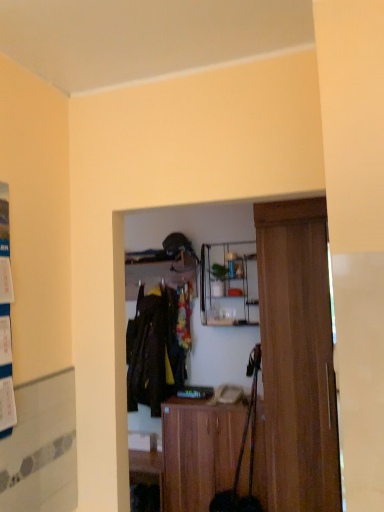
Question: Would you say wooden door at right is outside white paper poster at left?

Choices:
 (A) yes
 (B) no

Answer: (A)

Question: From the image's perspective, does wooden door at right appear higher than white paper poster at left?

Choices:
 (A) no
 (B) yes

Answer: (A)

Question: Can you confirm if wooden door at right is shorter than white paper poster at left?

Choices:
 (A) no
 (B) yes

Answer: (A)

Question: Does wooden door at right have a smaller size compared to white paper poster at left?

Choices:
 (A) no
 (B) yes

Answer: (A)

Question: Would you say wooden door at right contains white paper poster at left?

Choices:
 (A) yes
 (B) no

Answer: (B)

Question: Is wooden door at right thinner than white paper poster at left?

Choices:
 (A) yes
 (B) no

Answer: (B)

Question: From a real-world perspective, is wooden shelf at center, the 2th shelf in the right-to-left sequence, located beneath wooden door at right?

Choices:
 (A) no
 (B) yes

Answer: (A)

Question: Considering the relative sizes of wooden shelf at center, the 2th shelf in the right-to-left sequence, and wooden door at right in the image provided, is wooden shelf at center, the 2th shelf in the right-to-left sequence, shorter than wooden door at right?

Choices:
 (A) no
 (B) yes

Answer: (B)

Question: Can we say wooden shelf at center, the 2th shelf in the right-to-left sequence, lies outside wooden door at right?

Choices:
 (A) no
 (B) yes

Answer: (B)

Question: From a real-world perspective, is wooden shelf at center, the 1th shelf when ordered from left to right, on top of wooden door at right?

Choices:
 (A) no
 (B) yes

Answer: (B)

Question: From the image's perspective, is wooden shelf at center, the 1th shelf when ordered from left to right, under wooden door at right?

Choices:
 (A) no
 (B) yes

Answer: (A)

Question: Considering the relative sizes of wooden shelf at center, the 1th shelf when ordered from left to right, and wooden door at right in the image provided, is wooden shelf at center, the 1th shelf when ordered from left to right, bigger than wooden door at right?

Choices:
 (A) yes
 (B) no

Answer: (B)

Question: Is wooden cabinet at center thinner than dark brown fabric coat at center?

Choices:
 (A) yes
 (B) no

Answer: (B)